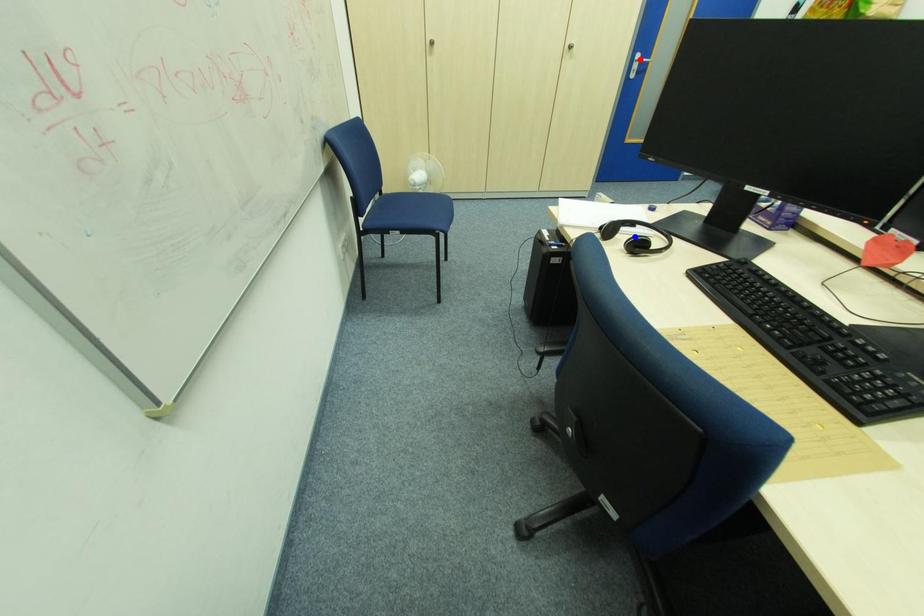
Question: In the image, two points are highlighted. Which point is nearer to the camera? Reply with the corresponding letter.

Choices:
 (A) blue point
 (B) red point

Answer: (A)